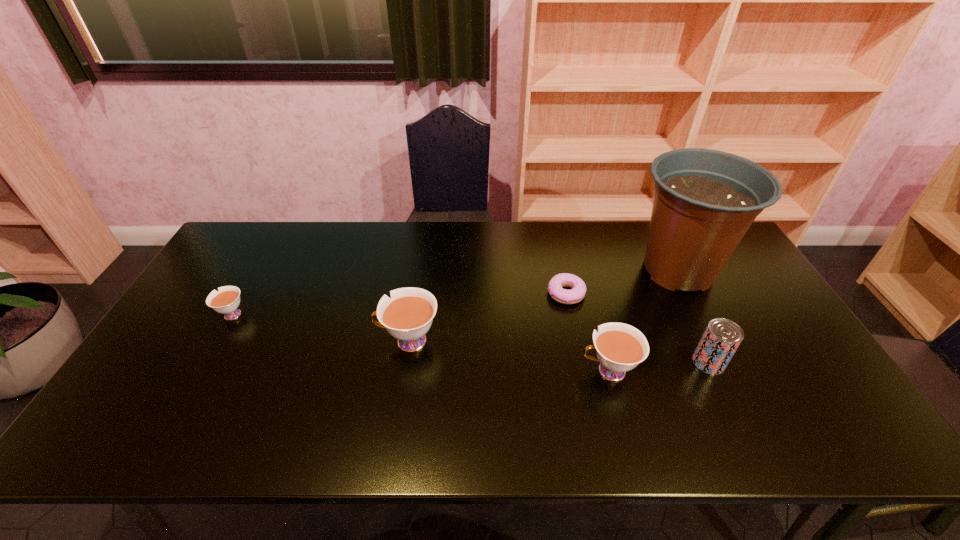
At what (x,y) coordinates should I click in order to perform the action: click on vacant position in the image that satisfies the following two spatial constraints: 1. on the side of the shortest teacup with the handle; 2. on the back side of the beer can. Please return your answer as a coordinate pair (x, y). The image size is (960, 540). Looking at the image, I should click on (204, 362).

What are the coordinates of `free location that satisfies the following two spatial constraints: 1. on the side of the leftmost teacup with the handle; 2. on the back side of the beer can` in the screenshot? It's located at (204, 362).